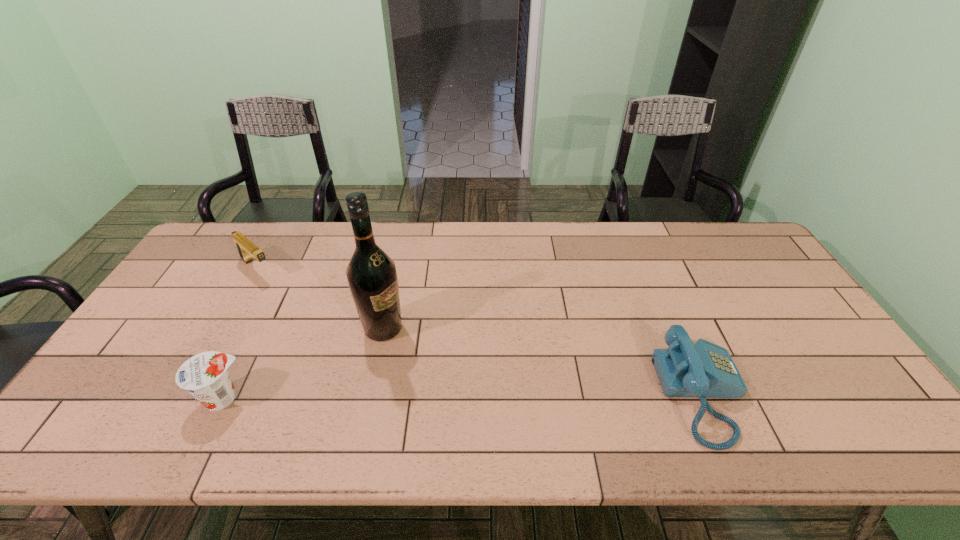
What are the coordinates of `free space located 0.090m at the barrel of the farthest object` in the screenshot? It's located at (284, 291).

Where is `free space located at the barrel of the farthest object`? free space located at the barrel of the farthest object is located at coordinates (286, 293).

The image size is (960, 540). In order to click on vacant space located at the barrel of the farthest object in this screenshot , I will do `click(306, 310)`.

Identify the location of object located in the far edge section of the desktop. (246, 249).

Where is `yogurt present at the near edge`? The image size is (960, 540). yogurt present at the near edge is located at coordinates (205, 376).

Identify the location of telephone at the near edge. This screenshot has width=960, height=540. (706, 370).

Identify the location of object located in the left edge section of the desktop. The image size is (960, 540). (246, 249).

Identify the location of object located at the far left corner. Image resolution: width=960 pixels, height=540 pixels. (246, 249).

Locate an element on the screen. This screenshot has width=960, height=540. vacant area at the far edge of the desktop is located at coordinates (659, 234).

Image resolution: width=960 pixels, height=540 pixels. I want to click on free location at the near edge, so click(x=291, y=400).